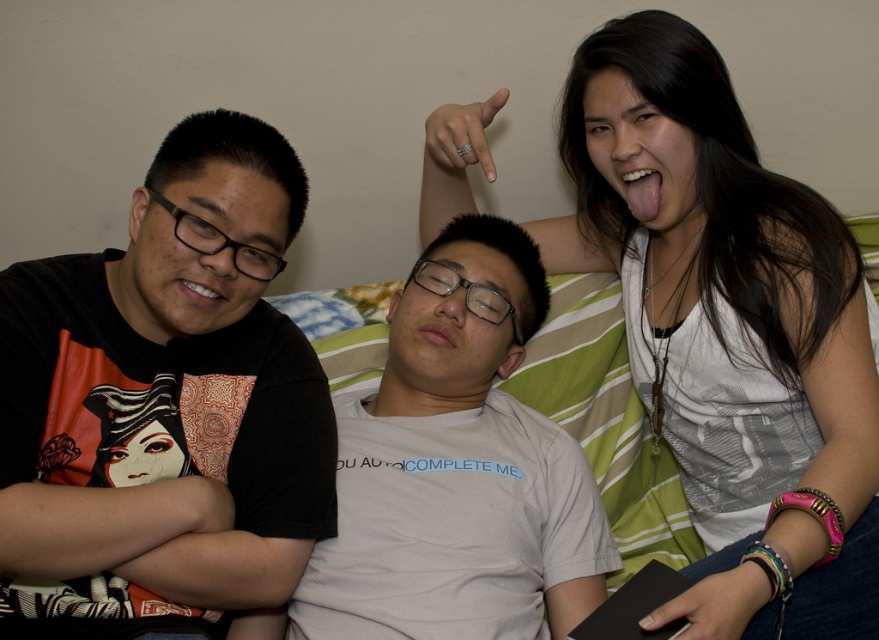
Is black matte t-shirt at left thinner than white cotton t-shirt at center?

Yes.

Between point (151, 547) and point (367, 484), which one is positioned behind?

Point (367, 484)

What are the coordinates of `black matte t-shirt at left` in the screenshot? It's located at (164, 406).

Between point (776, 476) and point (434, 422), which one is positioned behind?

Point (434, 422)

In the scene shown: Can you confirm if white fabric at upper right is smaller than white cotton t-shirt at center?

No.

Who is more forward, (870, 604) or (423, 372)?

Point (870, 604) is more forward.

At what (x,y) coordinates should I click in order to perform the action: click on white fabric at upper right. Please return your answer as a coordinate pair (x, y). Looking at the image, I should click on (728, 328).

Is point (62, 416) positioned before point (599, 125)?

Yes.

Is black matte t-shirt at left behind white fabric at upper right?

Yes, it is.

Is point (278, 212) closer to viewer compared to point (579, 252)?

That is True.

Locate an element on the screen. The width and height of the screenshot is (879, 640). black matte t-shirt at left is located at coordinates click(x=164, y=406).